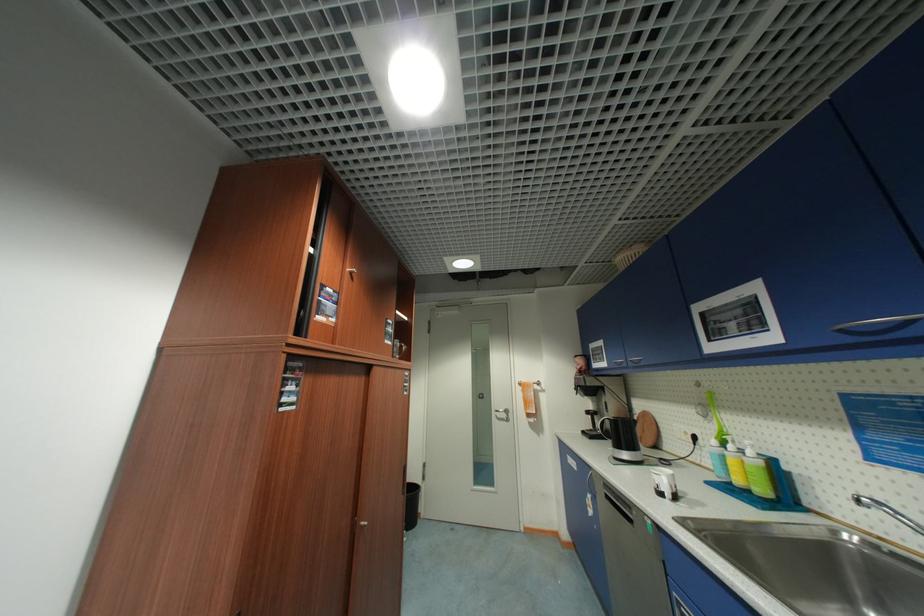
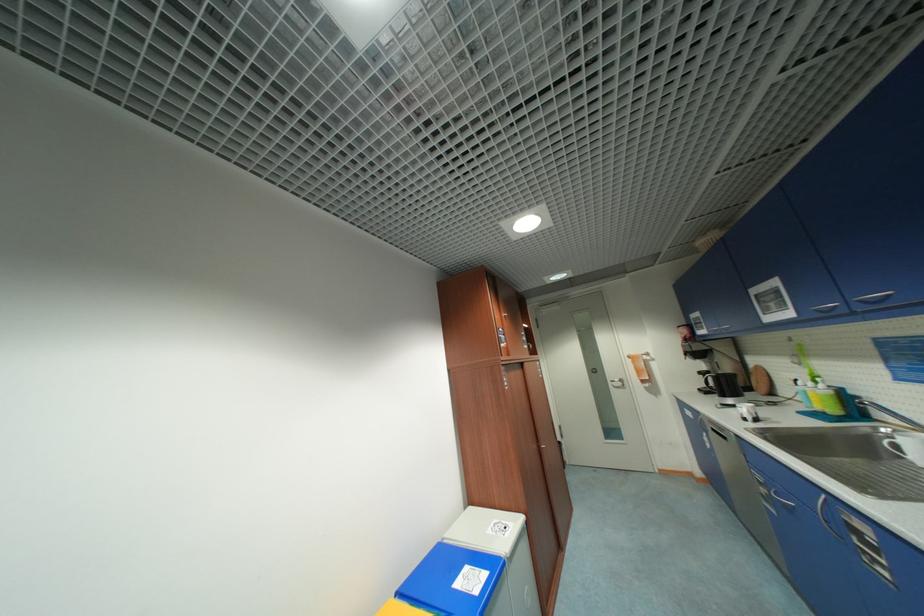
Find the pixel in the second image that matches (847,331) in the first image.

(822, 312)